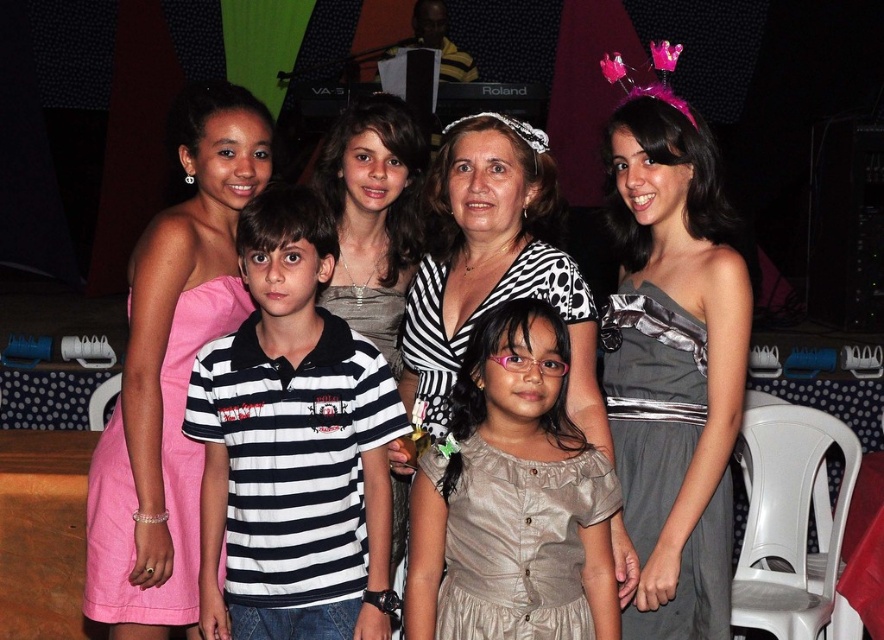
Locate an element on the screen. This screenshot has width=884, height=640. black striped shirt at center is located at coordinates (292, 445).

Is point (367, 417) behind point (458, 429)?

Yes, it is.

Where is `black striped shirt at center`? Image resolution: width=884 pixels, height=640 pixels. black striped shirt at center is located at coordinates (292, 445).

Between pink satin dress at left and pink fabric tiara at center, which one is positioned higher?

pink fabric tiara at center is above.

Which is behind, point (93, 480) or point (543, 138)?

The point (543, 138) is more distant.

The height and width of the screenshot is (640, 884). Find the location of `pink satin dress at left`. pink satin dress at left is located at coordinates (161, 476).

Does matte black dress at upper left have a greater width compared to pink satin dress at left?

Yes.

Which is above, matte black dress at upper left or pink satin dress at left?

matte black dress at upper left is above.

Which is behind, point (656, 356) or point (174, 525)?

Point (174, 525)

You are a GUI agent. You are given a task and a screenshot of the screen. Output one action in this format:
    pyautogui.click(x=<x>, y=<y>)
    Task: Click on the matte black dress at upper left
    
    Given the screenshot: What is the action you would take?
    pyautogui.click(x=669, y=362)